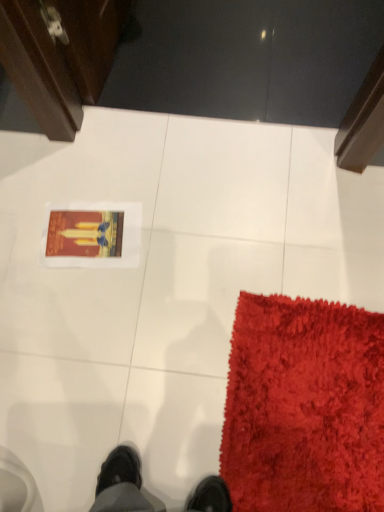
I want to click on vacant point above shaggy red rug at lower right (from a real-world perspective), so click(303, 416).